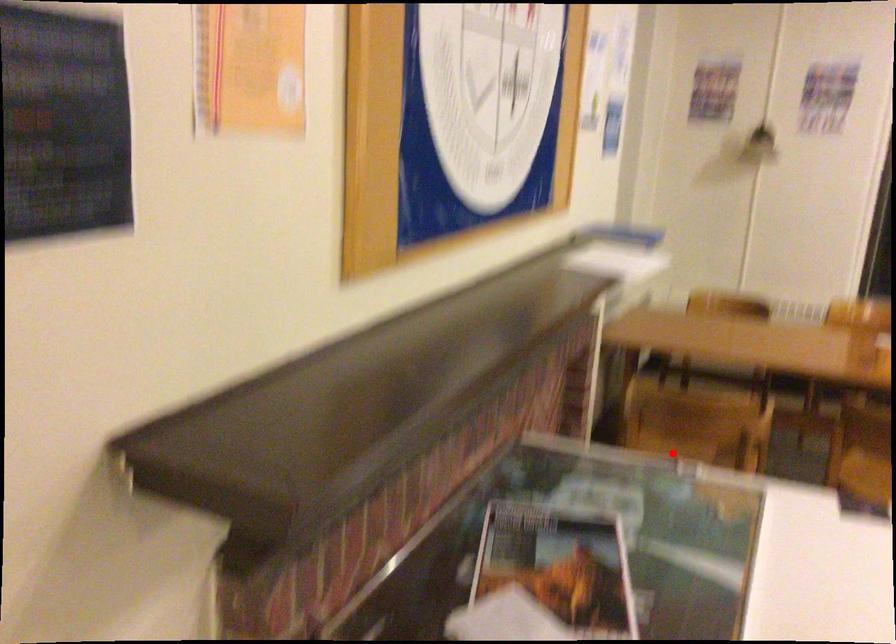
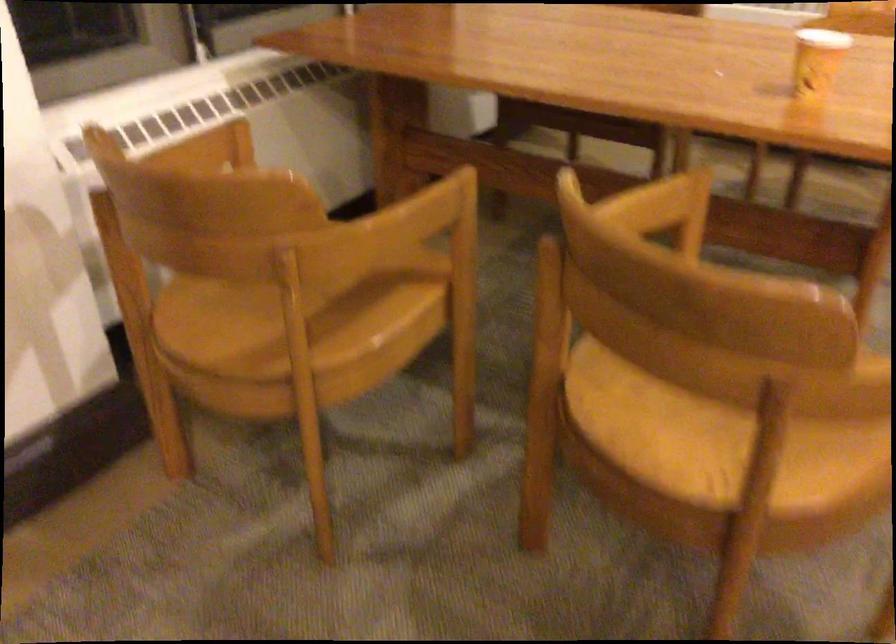
Find the pixel in the second image that matches the highlighted location in the first image.

(304, 297)